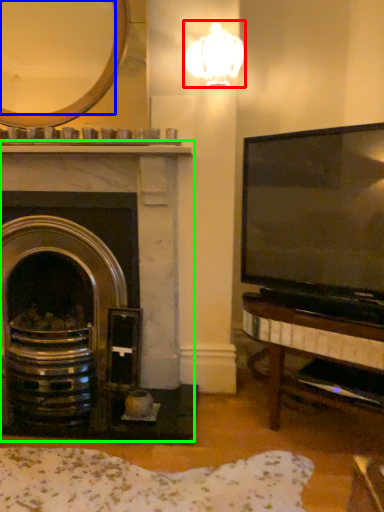
Question: Which object is the closest to the lamp (highlighted by a red box)? Choose among these: mirror (highlighted by a blue box) or fireplace (highlighted by a green box).

Choices:
 (A) mirror
 (B) fireplace

Answer: (A)